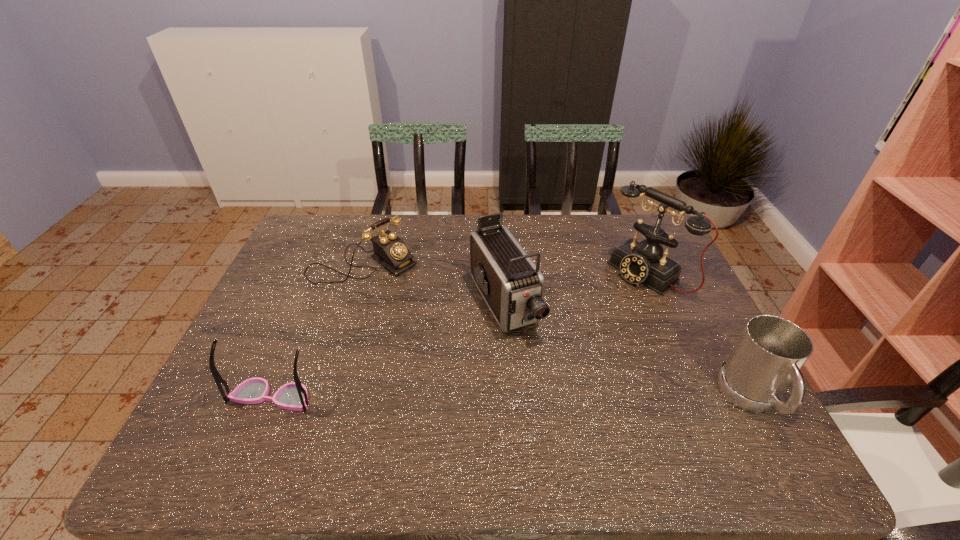
Where is `telephone that is at the right edge`? telephone that is at the right edge is located at coordinates (643, 262).

This screenshot has height=540, width=960. I want to click on object located at the far left corner, so 390,251.

The width and height of the screenshot is (960, 540). Identify the location of object located in the near left corner section of the desktop. (293, 396).

I want to click on object that is at the far right corner, so click(x=643, y=262).

This screenshot has height=540, width=960. Identify the location of object located in the near right corner section of the desktop. (770, 352).

This screenshot has width=960, height=540. In the image, there is a desktop. What are the coordinates of `blank space at the far edge` in the screenshot? It's located at [447, 241].

You are a GUI agent. You are given a task and a screenshot of the screen. Output one action in this format:
    pyautogui.click(x=<x>, y=<y>)
    Task: Click on the blank space at the near edge of the desktop
    
    Given the screenshot: What is the action you would take?
    pyautogui.click(x=367, y=399)

This screenshot has width=960, height=540. In the image, there is a desktop. Identify the location of vacant space at the left edge. (266, 329).

The image size is (960, 540). I want to click on vacant area at the right edge, so click(678, 305).

Identify the location of vacant space at the far left corner of the desktop. The height and width of the screenshot is (540, 960). (322, 237).